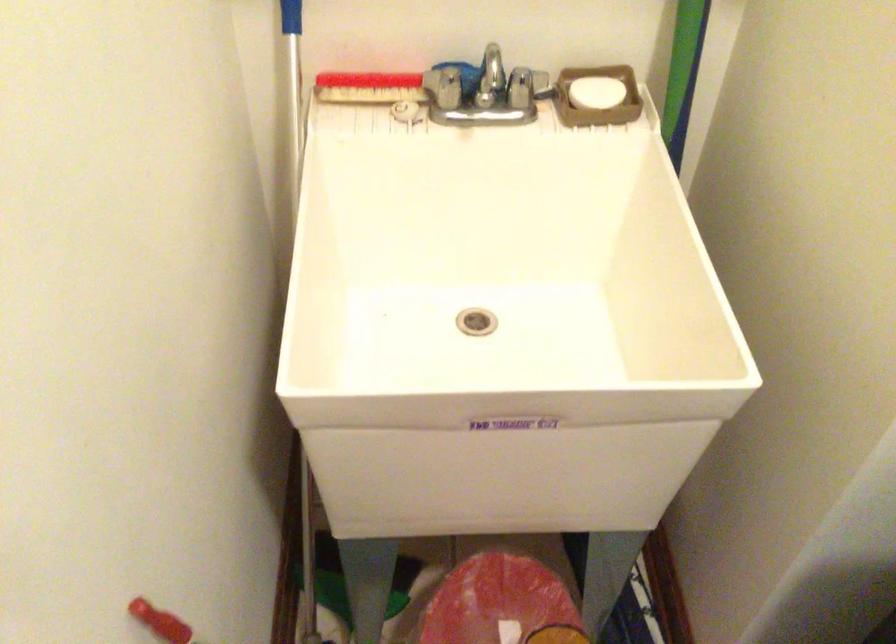
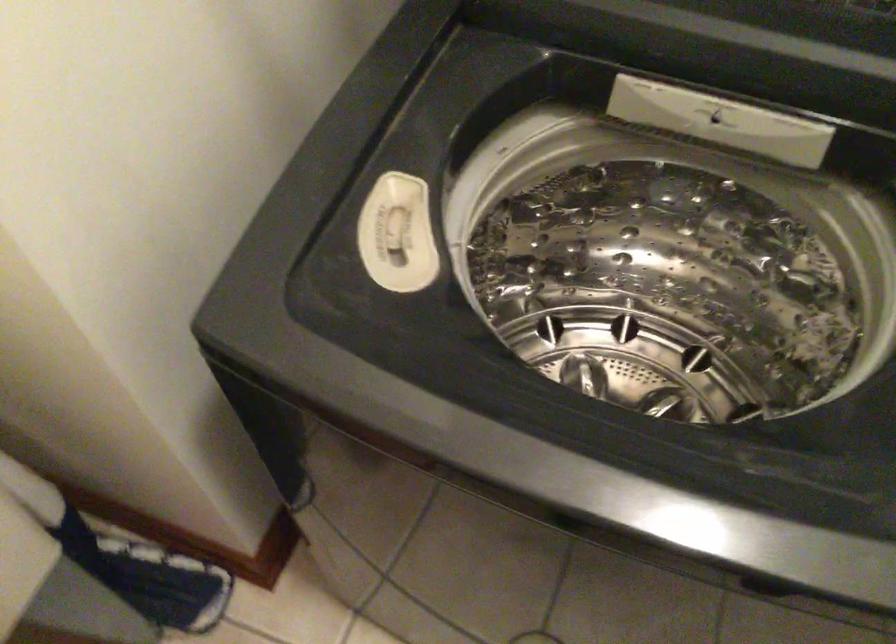
In the scene shown: The images are taken continuously from a first-person perspective. In which direction is your viewpoint rotating?

The rotation direction of the camera is right-down.